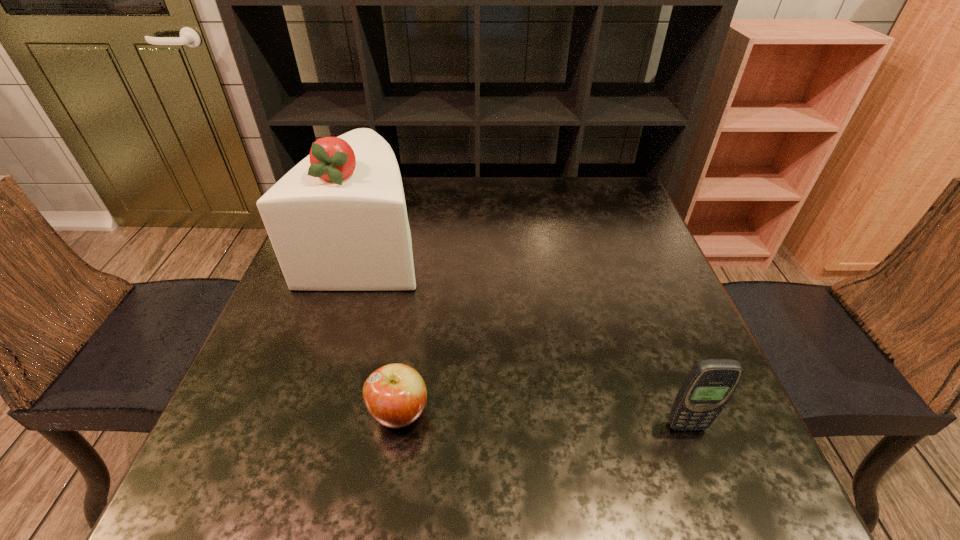
Locate an element on the screen. This screenshot has height=540, width=960. cake is located at coordinates pyautogui.click(x=337, y=221).

This screenshot has width=960, height=540. In order to click on the tallest object in this screenshot , I will do (x=337, y=221).

Locate an element on the screen. the second shortest object is located at coordinates (710, 384).

I want to click on cellular telephone, so click(x=710, y=384).

The image size is (960, 540). What are the coordinates of `apple` in the screenshot? It's located at (395, 395).

At what (x,y) coordinates should I click in order to perform the action: click on vacant area situated 0.320m on the right of the cake. Please return your answer as a coordinate pair (x, y). Looking at the image, I should click on (550, 245).

The height and width of the screenshot is (540, 960). I want to click on vacant area situated 0.070m on the screen of the rightmost object, so click(x=704, y=472).

Find the location of a particular element. This screenshot has width=960, height=540. vacant space located on the right of the apple is located at coordinates (464, 413).

Identify the location of object that is positioned at the far edge. tap(337, 221).

Identify the location of object that is at the left edge. This screenshot has width=960, height=540. (337, 221).